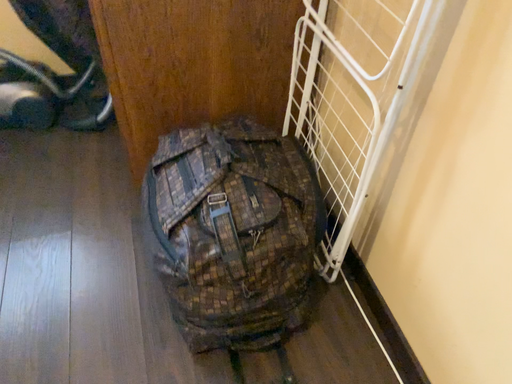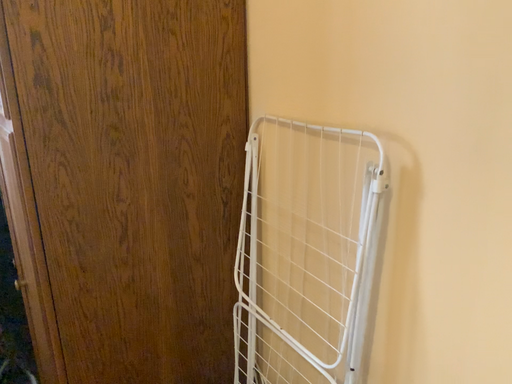
Question: Which way did the camera rotate in the video?

Choices:
 (A) rotated upward
 (B) rotated downward

Answer: (A)